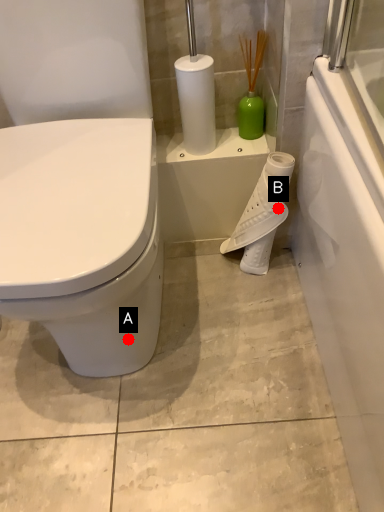
Question: Two points are circled on the image, labeled by A and B beside each circle. Which point is farther from the camera taking this photo?

Choices:
 (A) A is further
 (B) B is further

Answer: (B)